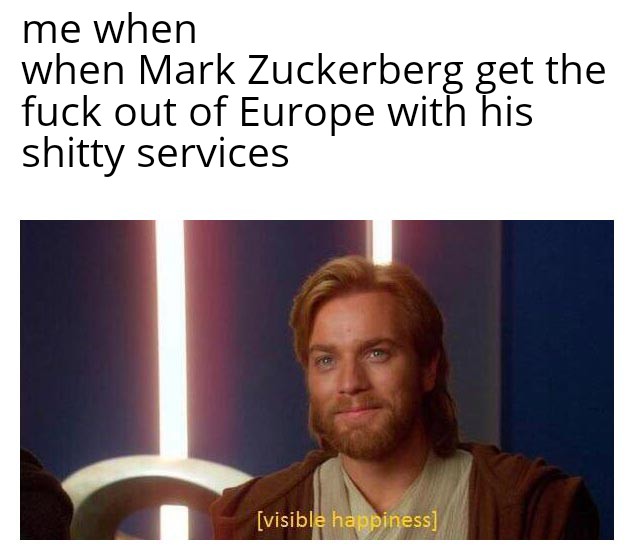
Image resolution: width=634 pixels, height=560 pixels. In order to click on light bar in the background of the meme in this screenshot , I will do click(x=169, y=328).